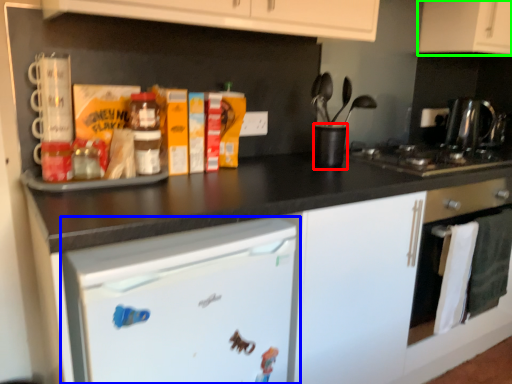
Question: Which object is positioned farthest from appliance (highlighted by a red box)? Select from home appliance (highlighted by a blue box) and cabinetry (highlighted by a green box).

Choices:
 (A) home appliance
 (B) cabinetry

Answer: (B)